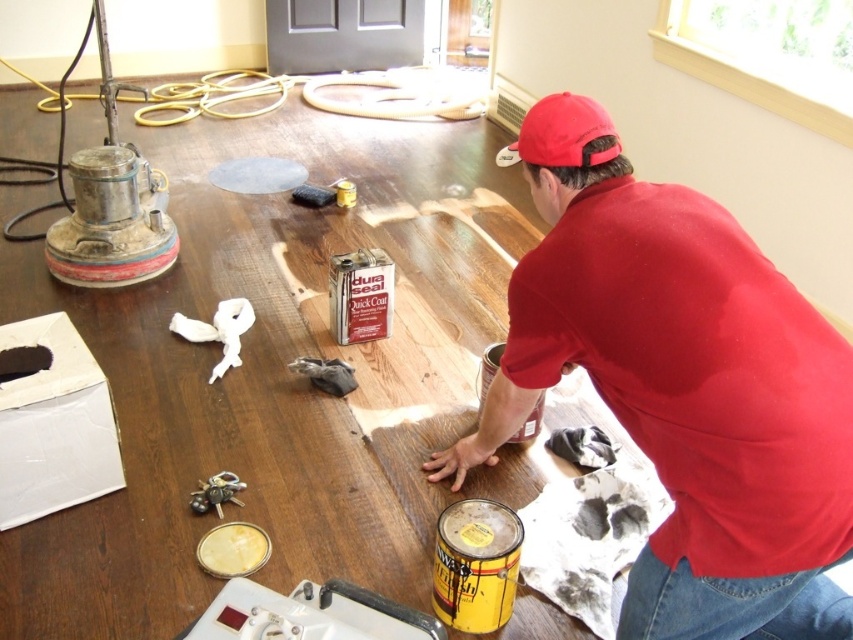
You are a fashion designer observing the person in the scene. You need to determine which item has a greater width between the matte red shirt at center and the red fabric baseball cap at upper center. Which one is wider?

The matte red shirt at center has a greater width than the red fabric baseball cap at upper center according to the description.

You are a photographer trying to capture the scene from the front. Which object, the matte red shirt at center or the red fabric baseball cap at upper center, will appear larger in your photo?

The matte red shirt at center will appear larger in the photo because it is closer to the viewer than the red fabric baseball cap at upper center.

You are a fashion designer observing the person in the image. Which item of clothing is larger in size between the matte red shirt at center and the red fabric baseball cap at upper center?

The matte red shirt at center is bigger than the red fabric baseball cap at upper center.